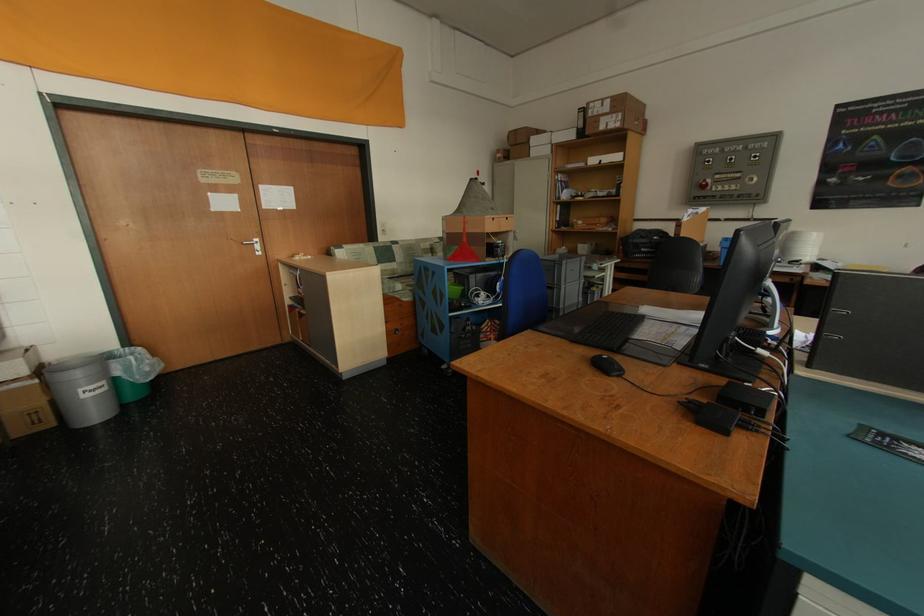
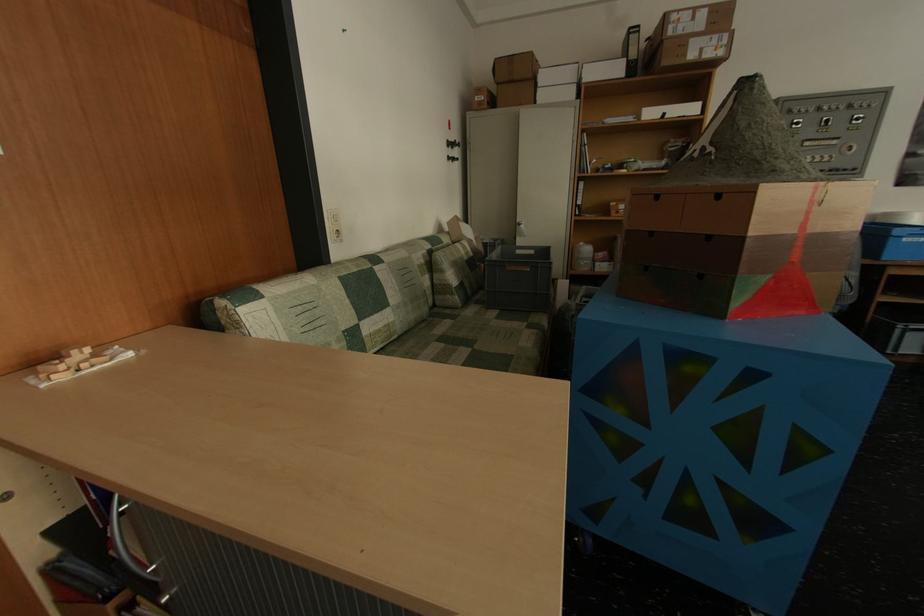
Looking at this image, in a continuous first-person perspective shot, in which direction is the camera moving?

The cameraman moved toward left, forward.